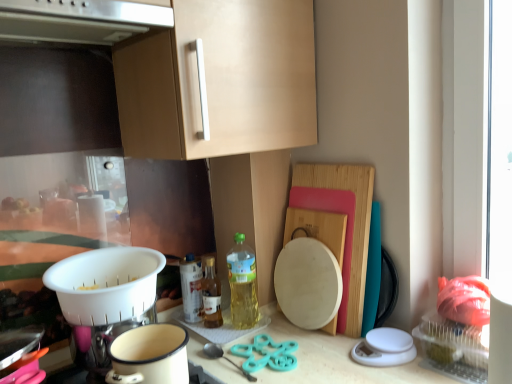
Question: From a real-world perspective, is satin silver exhaust hood at upper center on top of white enamel pot at lower center?

Choices:
 (A) yes
 (B) no

Answer: (A)

Question: Can you confirm if satin silver exhaust hood at upper center is positioned to the right of white enamel pot at lower center?

Choices:
 (A) yes
 (B) no

Answer: (B)

Question: Considering the relative sizes of satin silver exhaust hood at upper center and white enamel pot at lower center in the image provided, is satin silver exhaust hood at upper center wider than white enamel pot at lower center?

Choices:
 (A) no
 (B) yes

Answer: (B)

Question: Would you say white enamel pot at lower center is part of satin silver exhaust hood at upper center's contents?

Choices:
 (A) no
 (B) yes

Answer: (A)

Question: Can you see satin silver exhaust hood at upper center touching white enamel pot at lower center?

Choices:
 (A) yes
 (B) no

Answer: (B)

Question: Would you say teal plastic scissors at center is inside or outside translucent glass bottle at center, which is the second bottle in left-to-right order?

Choices:
 (A) inside
 (B) outside

Answer: (B)

Question: Based on their sizes in the image, would you say teal plastic scissors at center is bigger or smaller than translucent glass bottle at center, the second bottle positioned from the right?

Choices:
 (A) big
 (B) small

Answer: (B)

Question: Is point (232, 362) positioned closer to the camera than point (208, 286)?

Choices:
 (A) closer
 (B) farther

Answer: (A)

Question: From the image's perspective, is teal plastic scissors at center positioned above or below translucent glass bottle at center, the second bottle positioned from the right?

Choices:
 (A) below
 (B) above

Answer: (A)

Question: In terms of size, does white enamel pot at lower center appear bigger or smaller than satin silver exhaust hood at upper center?

Choices:
 (A) big
 (B) small

Answer: (B)

Question: From the image's perspective, relative to satin silver exhaust hood at upper center, is white enamel pot at lower center above or below?

Choices:
 (A) above
 (B) below

Answer: (B)

Question: In the image, is white enamel pot at lower center positioned in front of or behind satin silver exhaust hood at upper center?

Choices:
 (A) front
 (B) behind

Answer: (B)

Question: From a real-world perspective, relative to satin silver exhaust hood at upper center, is white enamel pot at lower center vertically above or below?

Choices:
 (A) below
 (B) above

Answer: (A)

Question: From their relative heights in the image, would you say translucent glass bottle at center, the second bottle positioned from the right, is taller or shorter than white plastic colander at lower left?

Choices:
 (A) tall
 (B) short

Answer: (A)

Question: In the image, is translucent glass bottle at center, which is the second bottle in left-to-right order, on the left side or the right side of white plastic colander at lower left?

Choices:
 (A) left
 (B) right

Answer: (B)